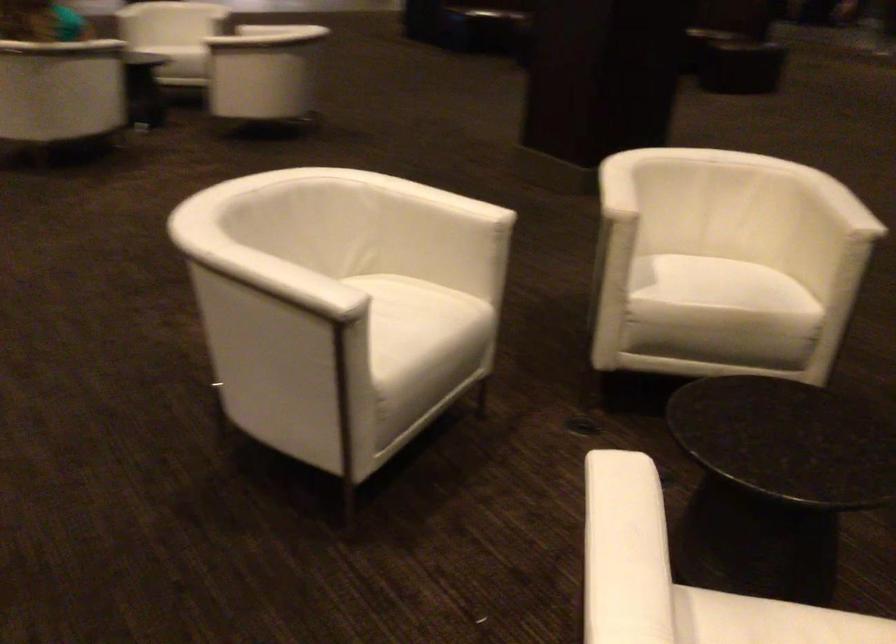
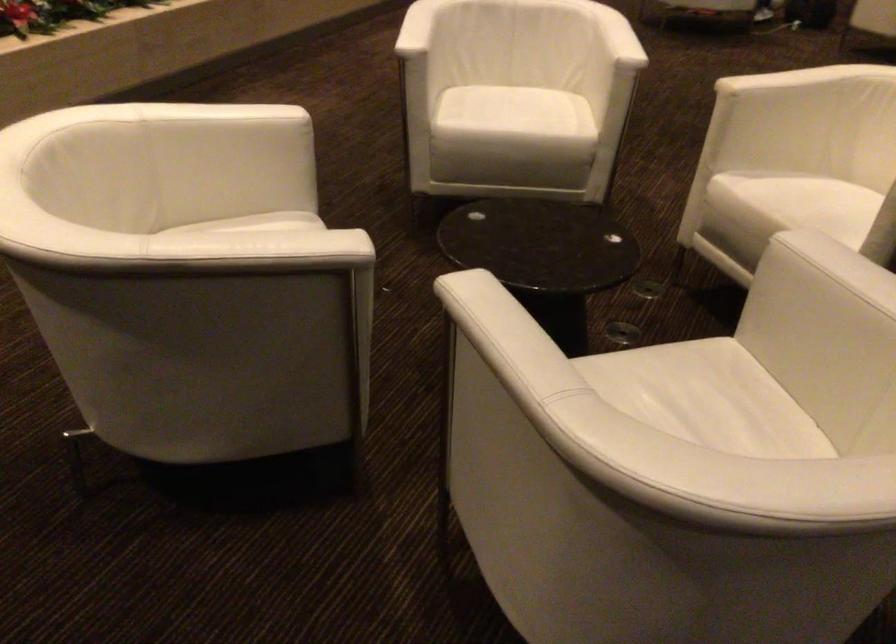
The point at (644, 189) is marked in the first image. Where is the corresponding point in the second image?

(789, 80)